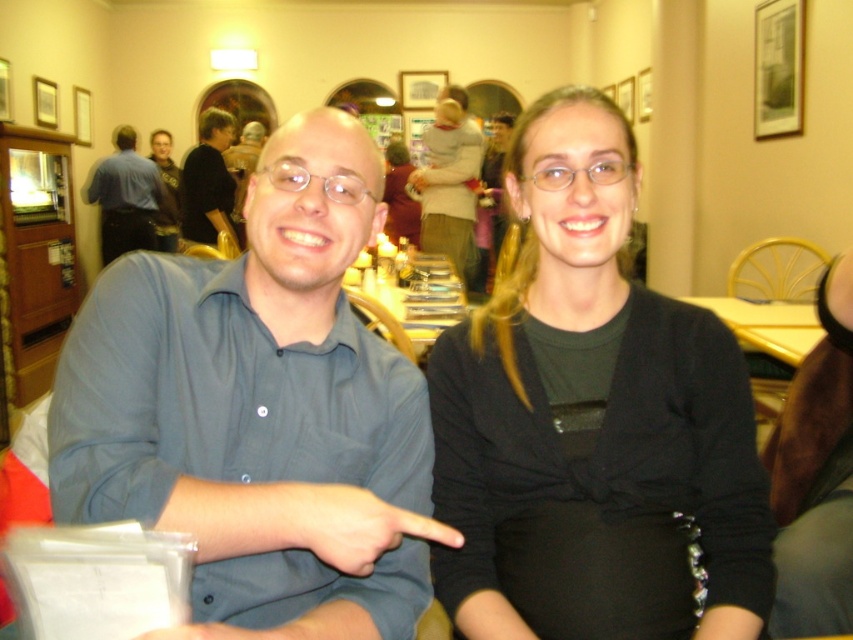
Question: Is blue button-down shirt at center bigger than blue shirt at center?

Choices:
 (A) no
 (B) yes

Answer: (A)

Question: Can you confirm if black matte shirt at center is bigger than matte black shirt at upper left?

Choices:
 (A) yes
 (B) no

Answer: (B)

Question: Which of the following is the closest to the observer?

Choices:
 (A) (262, 445)
 (B) (468, 625)
 (C) (215, 230)
 (D) (163, 188)

Answer: (A)

Question: Which point appears closest to the camera in this image?

Choices:
 (A) (190, 168)
 (B) (170, 208)
 (C) (592, 492)

Answer: (C)

Question: Is blue button-down shirt at center in front of matte black shirt at upper left?

Choices:
 (A) yes
 (B) no

Answer: (A)

Question: Among these points, which one is farthest from the camera?

Choices:
 (A) (457, 621)
 (B) (376, 550)
 (C) (218, 136)

Answer: (C)